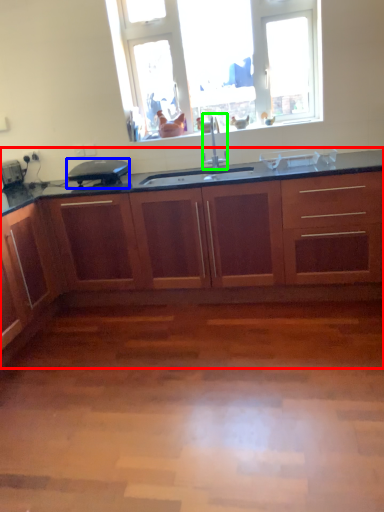
Question: Considering the real-world distances, which object is farthest from cabinetry (highlighted by a red box)? appliance (highlighted by a blue box) or faucet (highlighted by a green box)?

Choices:
 (A) appliance
 (B) faucet

Answer: (B)